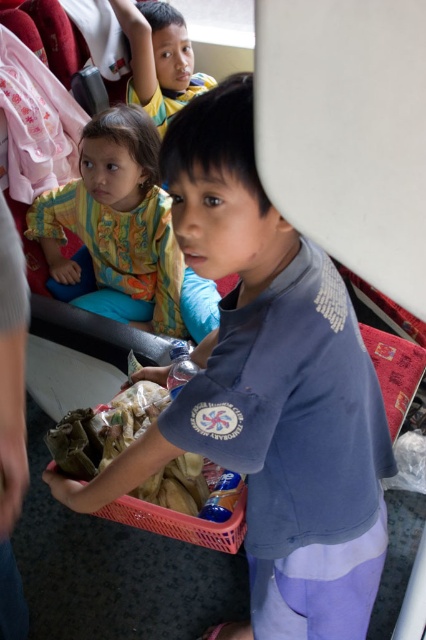
Question: Estimate the real-world distances between objects in this image. Which object is farther from the multicolored fabric shirt at upper left?

Choices:
 (A) blue cotton shirt at center
 (B) pink plastic basket at center
 (C) yellow shirt at upper left

Answer: (A)

Question: Which object appears farthest from the camera in this image?

Choices:
 (A) multicolored fabric shirt at upper left
 (B) blue cotton shirt at center

Answer: (A)

Question: Based on their relative distances, which object is farther from the yellow shirt at upper left?

Choices:
 (A) pink plastic basket at center
 (B) blue cotton shirt at center

Answer: (B)

Question: Can you confirm if multicolored fabric shirt at upper left is positioned to the left of yellow shirt at upper left?

Choices:
 (A) no
 (B) yes

Answer: (B)

Question: Can you confirm if multicolored fabric shirt at upper left is positioned to the right of yellow shirt at upper left?

Choices:
 (A) no
 (B) yes

Answer: (A)

Question: Does blue cotton shirt at center have a greater width compared to yellow shirt at upper left?

Choices:
 (A) no
 (B) yes

Answer: (B)